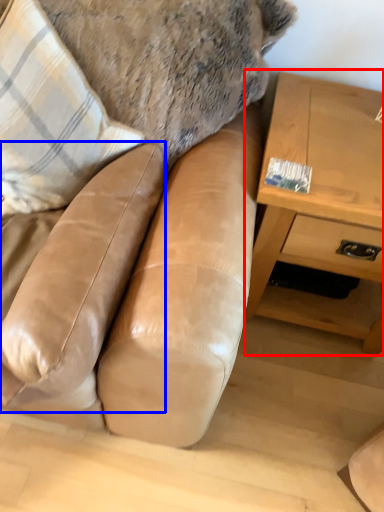
Question: Which of the following is the closest to the observer, table (highlighted by a red box) or swivel chair (highlighted by a blue box)?

Choices:
 (A) table
 (B) swivel chair

Answer: (B)